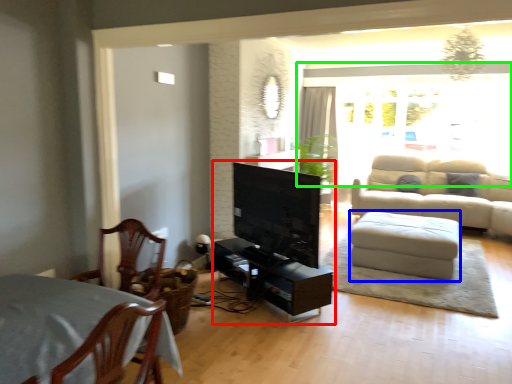
Question: Which object is the farthest from entertainment center (highlighted by a red box)? Choose among these: footrest (highlighted by a blue box) or window (highlighted by a green box).

Choices:
 (A) footrest
 (B) window

Answer: (B)